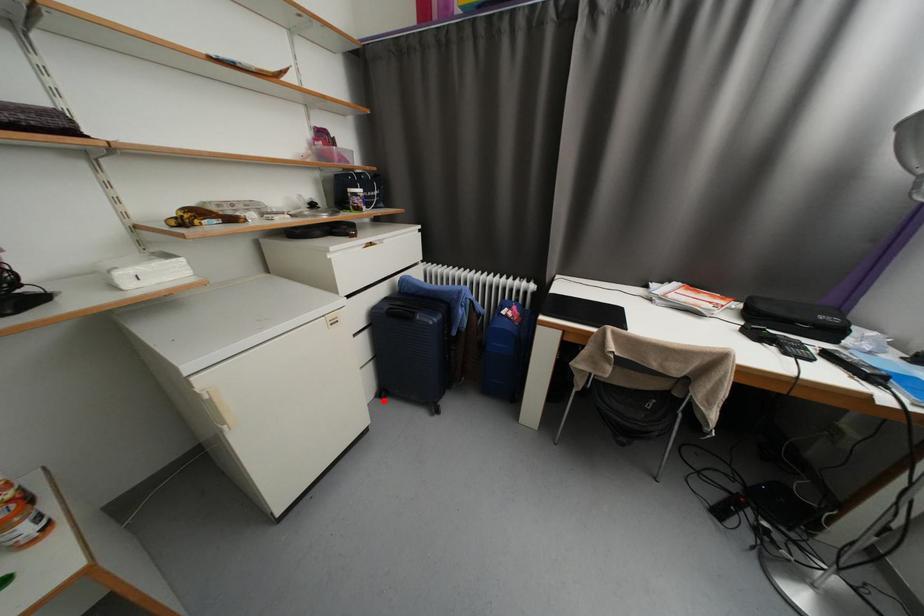
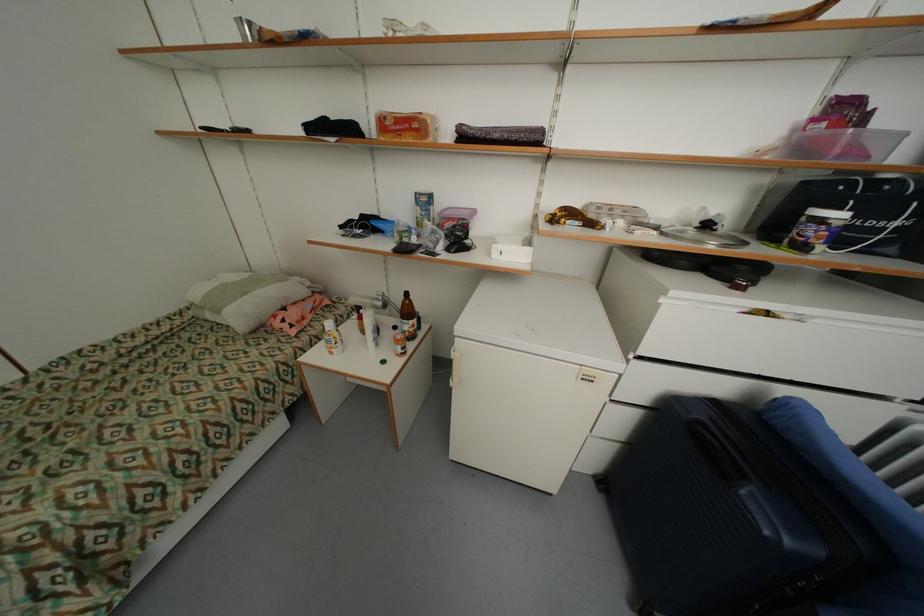
Question: I am providing you with two images of the same scene from different viewpoints. Given a red point in image1, look at the same physical point in image2. Is it:

Choices:
 (A) Closer to the viewpoint
 (B) Farther from the viewpoint

Answer: (B)